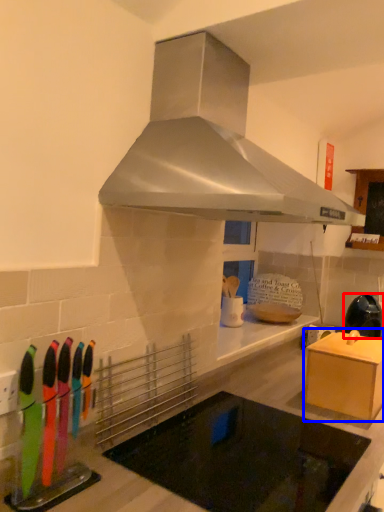
Question: Which object is further to the camera taking this photo, kitchen appliance (highlighted by a red box) or cabinetry (highlighted by a blue box)?

Choices:
 (A) kitchen appliance
 (B) cabinetry

Answer: (A)